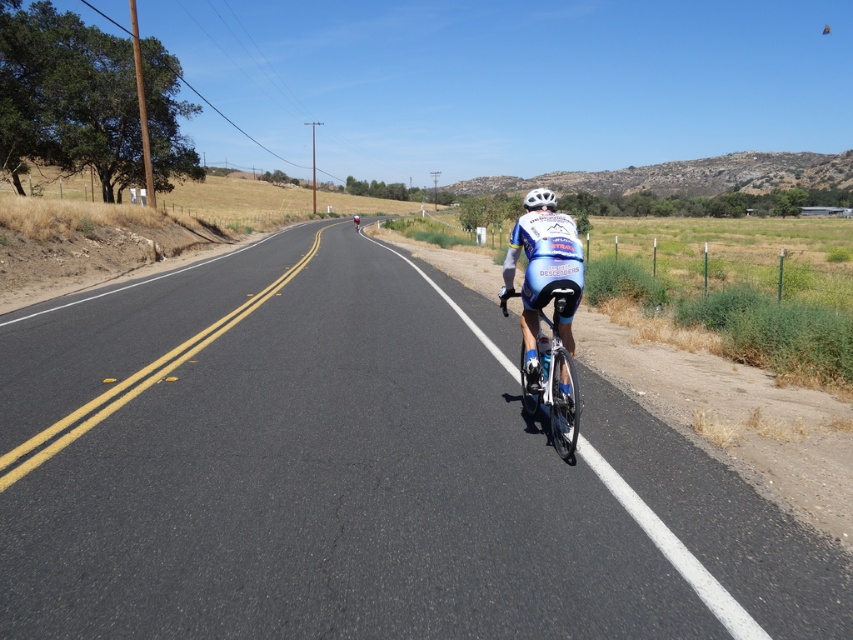
Question: Can you confirm if black asphalt road at center is positioned below white matte bicycle helmet at center?

Choices:
 (A) no
 (B) yes

Answer: (B)

Question: Does black asphalt road at center have a greater width compared to blue/white jersey at center?

Choices:
 (A) no
 (B) yes

Answer: (B)

Question: Which of the following is the closest to the observer?

Choices:
 (A) blue/white jersey at center
 (B) blue jersey cyclist at center
 (C) white matte bicycle helmet at center

Answer: (A)

Question: Can you confirm if shiny blue frame at center is positioned to the left of blue jersey cyclist at center?

Choices:
 (A) yes
 (B) no

Answer: (B)

Question: Which of the following is the closest to the observer?

Choices:
 (A) (544, 188)
 (B) (352, 225)

Answer: (A)

Question: Considering the real-world distances, which object is closest to the shiny blue frame at center?

Choices:
 (A) white matte bicycle helmet at center
 (B) black asphalt road at center

Answer: (A)